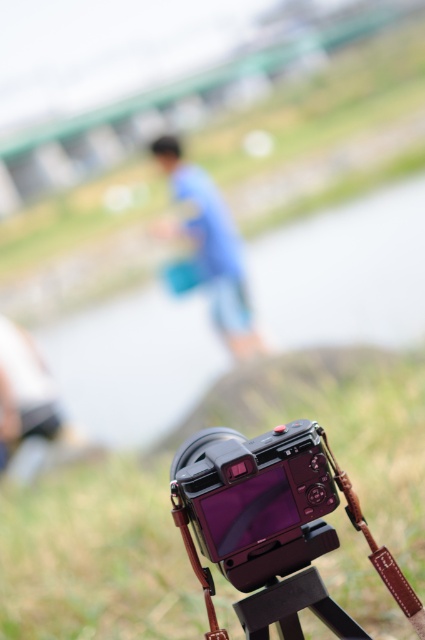
You are a photographer setting up equipment. You have a green grass at lower center and a satin black camera at center. Which object takes up more space in the image?

The green grass at lower center takes up more space in the image compared to the satin black camera at center because it has a larger size.

You are a photographer who wants to adjust the camera settings while standing on the green grass at lower center. Can you comfortably reach the camera without moving your feet? The average arm length for an adult is about 0.7 meters.

The distance between the green grass at lower center and the camera is 2.01 meters. Since the average adult arm length is 0.7 meters, you would not be able to comfortably reach the camera from the green grass at lower center without moving your feet.

You are a photographer setting up a shot with a camera on a tripod. You want to ensure the green grass at lower center is visible in your composition. Given that the camera is positioned on the grassy terrain, where should you place the camera relative to the point marked at coordinates point (96, 556)?

The point (96, 556) marks the green grass at lower center, so positioning the camera on the grassy terrain near this point will ensure the green grass at lower center is included in the composition.